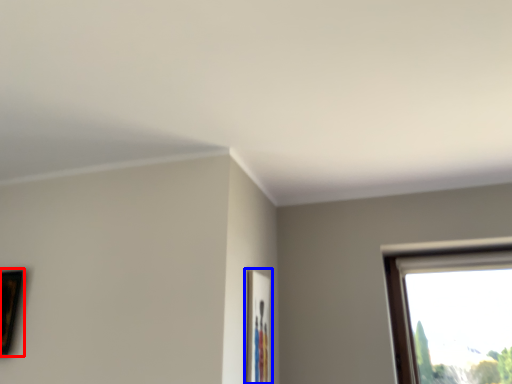
Question: Among these objects, which one is farthest to the camera, picture frame (highlighted by a red box) or picture frame (highlighted by a blue box)?

Choices:
 (A) picture frame
 (B) picture frame

Answer: (A)